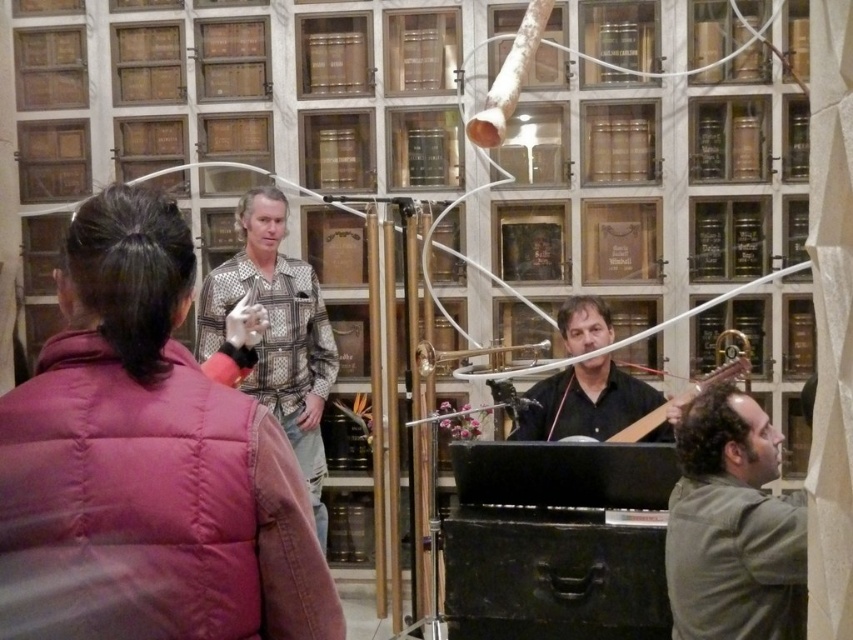
Which is in front, point (733, 477) or point (323, 317)?

Point (733, 477) is in front.

Is green matte shirt at lower right further to the viewer compared to patterned shirt at center?

That is False.

Does point (688, 518) come behind point (294, 404)?

No, it is in front of (294, 404).

Locate an element on the screen. The height and width of the screenshot is (640, 853). green matte shirt at lower right is located at coordinates (732, 525).

Between green matte shirt at lower right and black matte guitar at center, which one has more height?

green matte shirt at lower right is taller.

Which is behind, point (746, 621) or point (552, 426)?

Point (552, 426)

Is point (717, 579) less distant than point (595, 317)?

Yes, it is.

Image resolution: width=853 pixels, height=640 pixels. Find the location of `green matte shirt at lower right`. green matte shirt at lower right is located at coordinates (732, 525).

Between puffy pink vest at center and patterned shirt at center, which one has more height?

Standing taller between the two is patterned shirt at center.

The height and width of the screenshot is (640, 853). In order to click on puffy pink vest at center in this screenshot , I will do `click(148, 464)`.